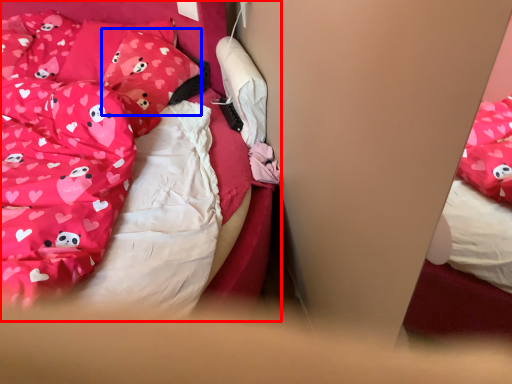
Question: Which object appears farthest to the camera in this image, bed (highlighted by a red box) or pillow (highlighted by a blue box)?

Choices:
 (A) bed
 (B) pillow

Answer: (B)